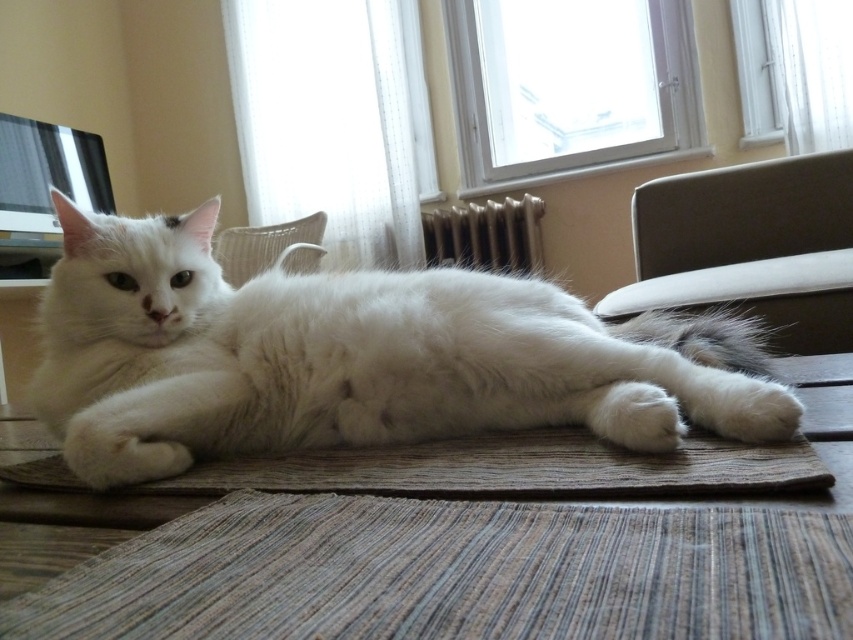
Does brown leather chair at upper right have a greater height compared to white fabric chair at upper center?

Correct, brown leather chair at upper right is much taller as white fabric chair at upper center.

Who is taller, brown leather chair at upper right or white fabric chair at upper center?

brown leather chair at upper right is taller.

Locate an element on the screen. brown leather chair at upper right is located at coordinates (749, 248).

Which is in front, point (631, 300) or point (334, 477)?

Point (334, 477) is in front.

Where is `brown leather chair at upper right`? brown leather chair at upper right is located at coordinates (749, 248).

Looking at this image, is brown woven mat at center further to camera compared to brown leather chair at upper right?

No, brown woven mat at center is in front of brown leather chair at upper right.

Is brown woven mat at center closer to the viewer compared to brown leather chair at upper right?

That is True.

The image size is (853, 640). I want to click on brown woven mat at center, so click(x=440, y=561).